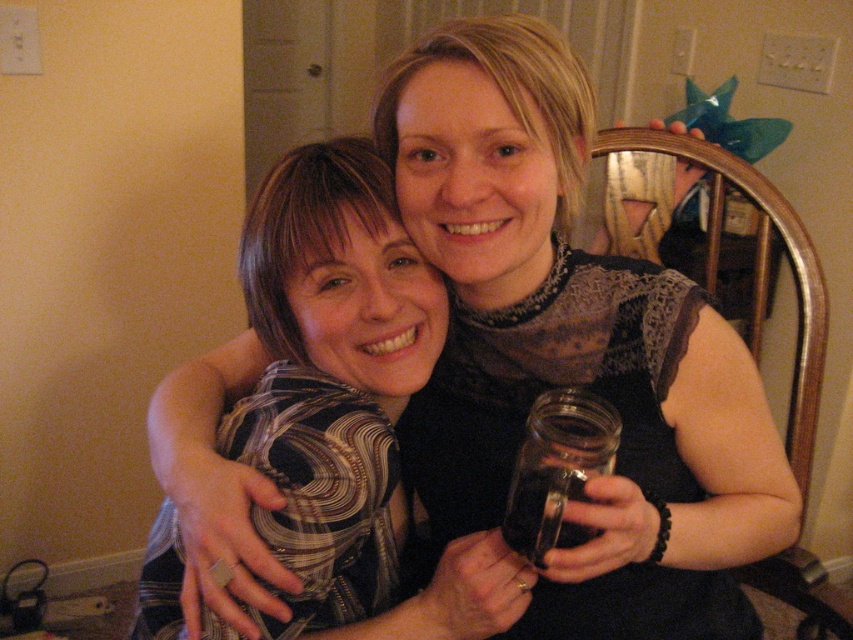
Question: Is the position of patterned fabric shirt at center less distant than that of wooden chair at upper right?

Choices:
 (A) no
 (B) yes

Answer: (B)

Question: Which point is farther from the camera taking this photo?

Choices:
 (A) (287, 355)
 (B) (556, 490)

Answer: (A)

Question: Which object appears closest to the camera in this image?

Choices:
 (A) wooden chair at upper right
 (B) transparent glass jar at center

Answer: (B)

Question: Does patterned fabric shirt at center appear on the left side of transparent glass jar at center?

Choices:
 (A) yes
 (B) no

Answer: (A)

Question: Which of the following is the closest to the observer?

Choices:
 (A) patterned fabric shirt at center
 (B) wooden chair at upper right
 (C) transparent glass jar at center

Answer: (C)

Question: Is patterned fabric shirt at center closer to camera compared to transparent glass jar at center?

Choices:
 (A) yes
 (B) no

Answer: (B)